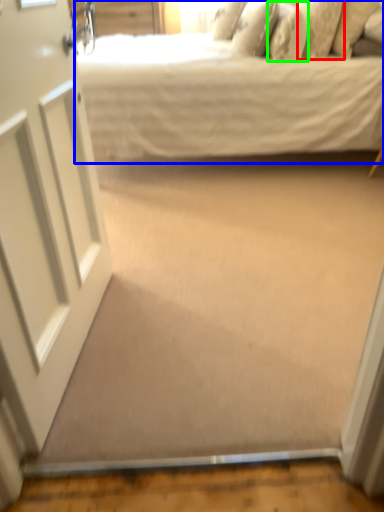
Question: Estimate the real-world distances between objects in this image. Which object is closer to pillow (highlighted by a red box), bed (highlighted by a blue box) or pillow (highlighted by a green box)?

Choices:
 (A) bed
 (B) pillow

Answer: (B)